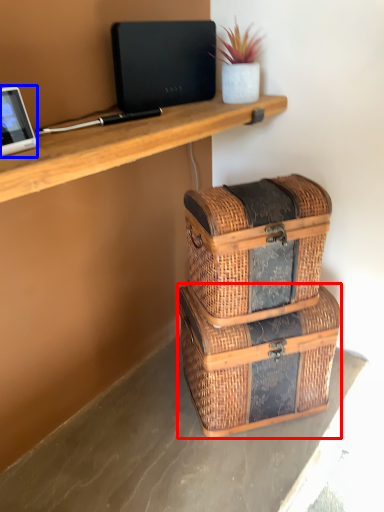
Question: Which point is further to the camera, storage box (highlighted by a red box) or tablet computer (highlighted by a blue box)?

Choices:
 (A) storage box
 (B) tablet computer

Answer: (A)